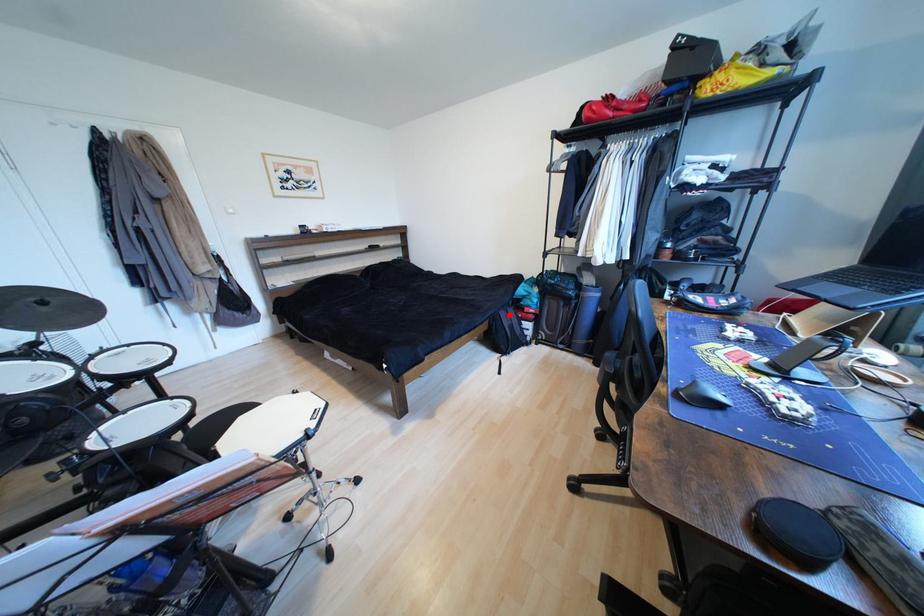
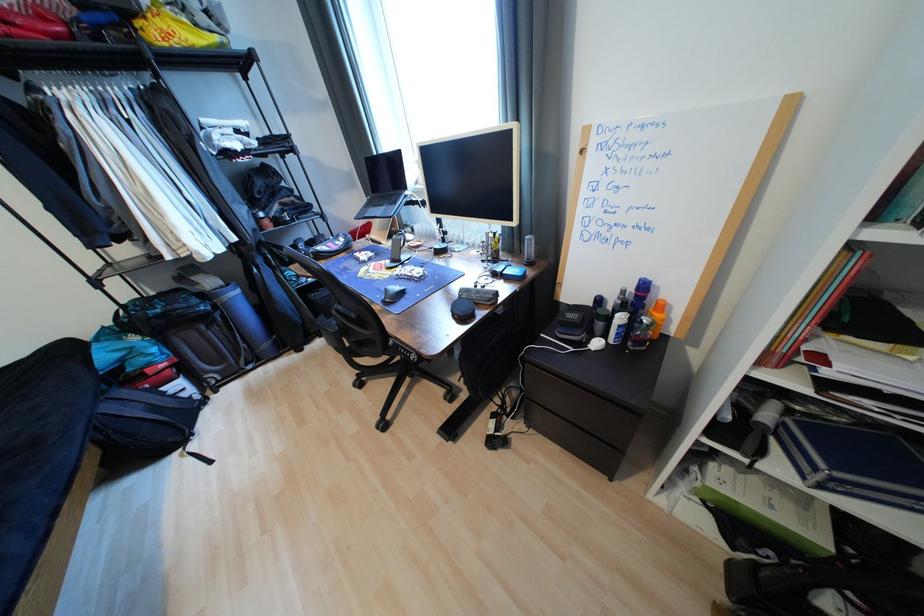
In the second image, find the point that corresponds to the highlighted location in the first image.

(116, 408)